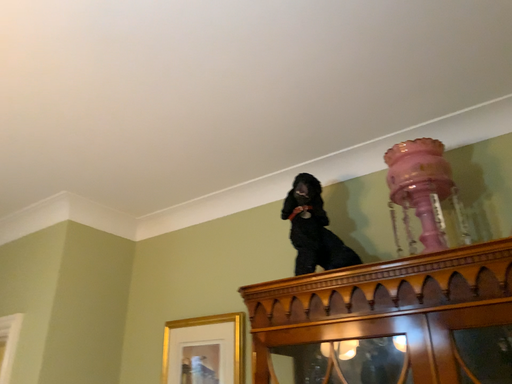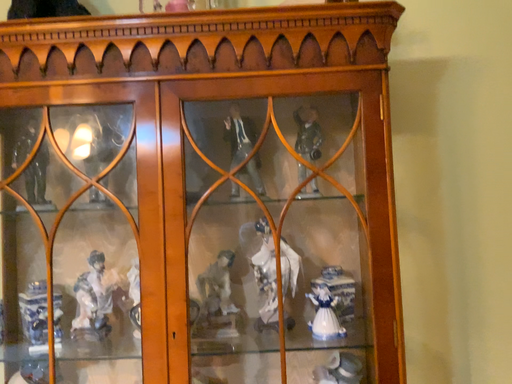
Question: Which way did the camera rotate in the video?

Choices:
 (A) rotated upward
 (B) rotated downward

Answer: (B)